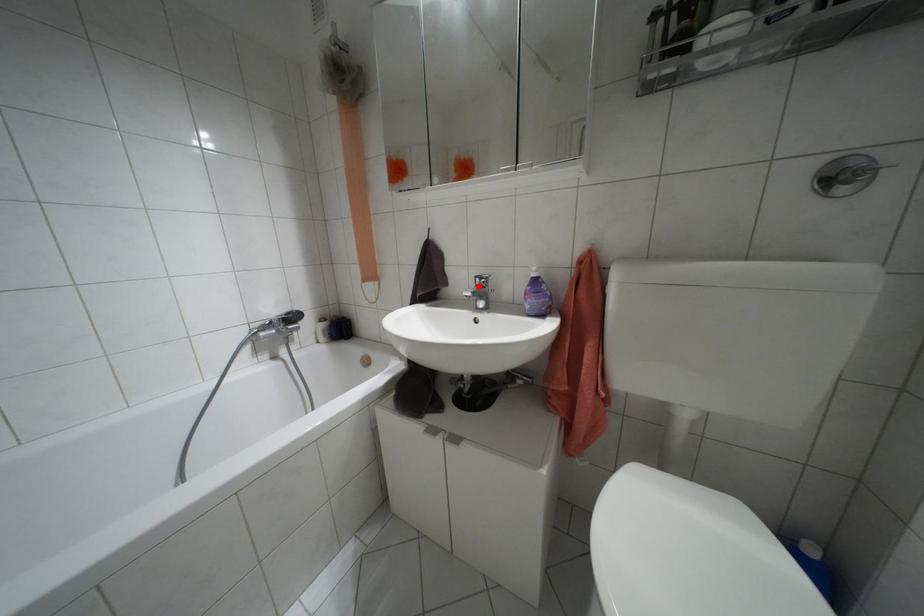
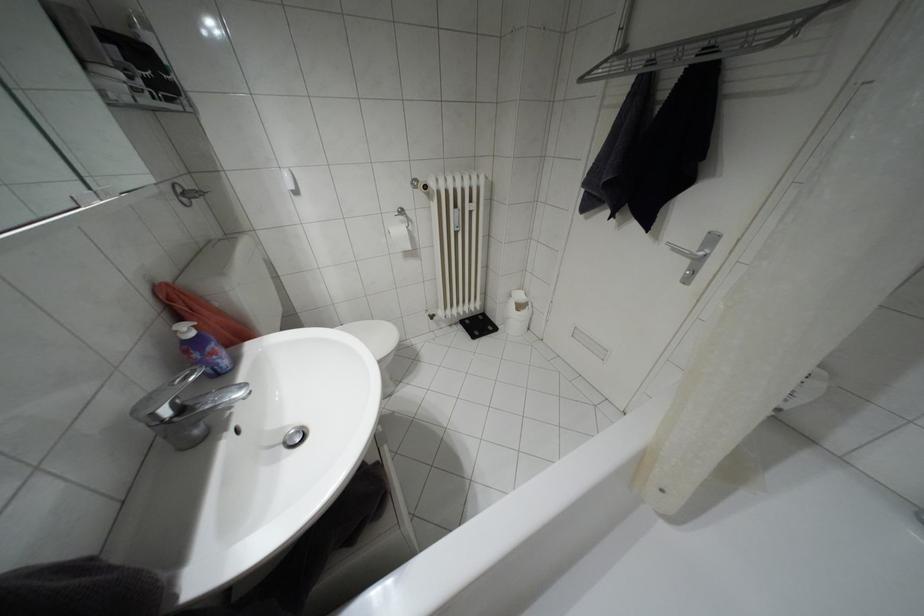
Where in the second image is the point corresponding to the highlighted location from the first image?

(180, 408)